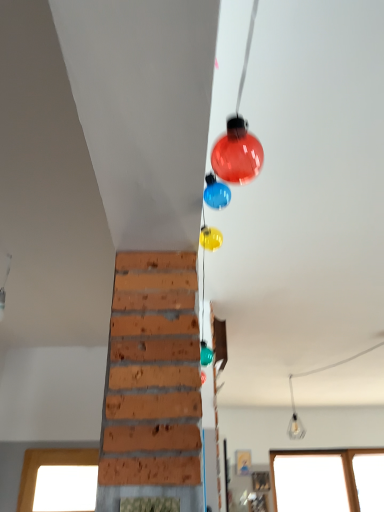
Question: Is clear glass light bulb at center inside the boundaries of transparent glass window at lower right, or outside?

Choices:
 (A) outside
 (B) inside

Answer: (A)

Question: In the image, is clear glass light bulb at center on the left side or the right side of transparent glass window at lower right?

Choices:
 (A) left
 (B) right

Answer: (A)

Question: Is clear glass light bulb at center taller or shorter than transparent glass window at lower right?

Choices:
 (A) short
 (B) tall

Answer: (A)

Question: Considering the relative positions of transparent glass window at lower right and clear glass light bulb at center in the image provided, is transparent glass window at lower right to the left or to the right of clear glass light bulb at center?

Choices:
 (A) left
 (B) right

Answer: (B)

Question: Is point (291, 478) closer or farther from the camera than point (294, 412)?

Choices:
 (A) farther
 (B) closer

Answer: (B)

Question: From the image's perspective, is transparent glass window at lower right positioned above or below clear glass light bulb at center?

Choices:
 (A) above
 (B) below

Answer: (B)

Question: Is transparent glass window at lower right wider or thinner than clear glass light bulb at center?

Choices:
 (A) thin
 (B) wide

Answer: (A)